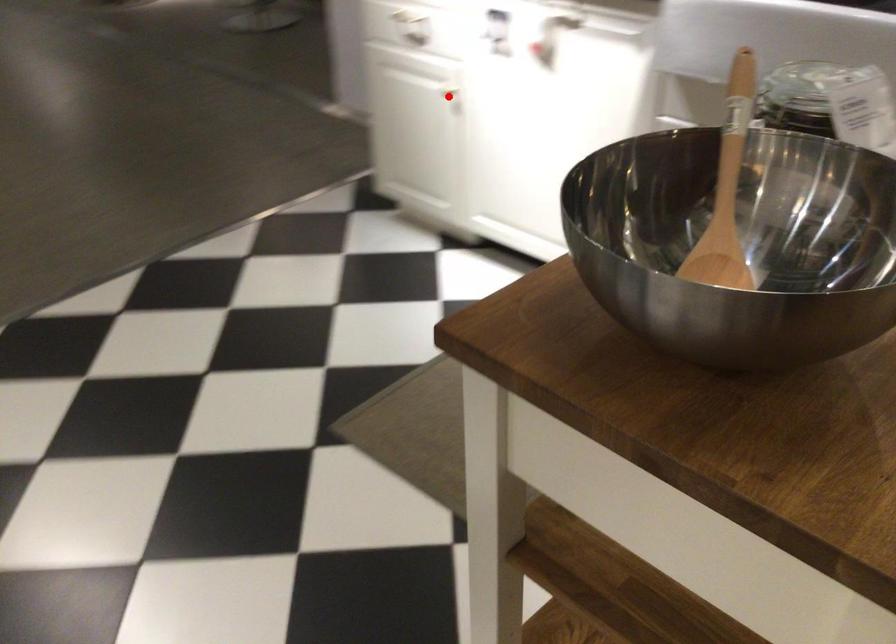
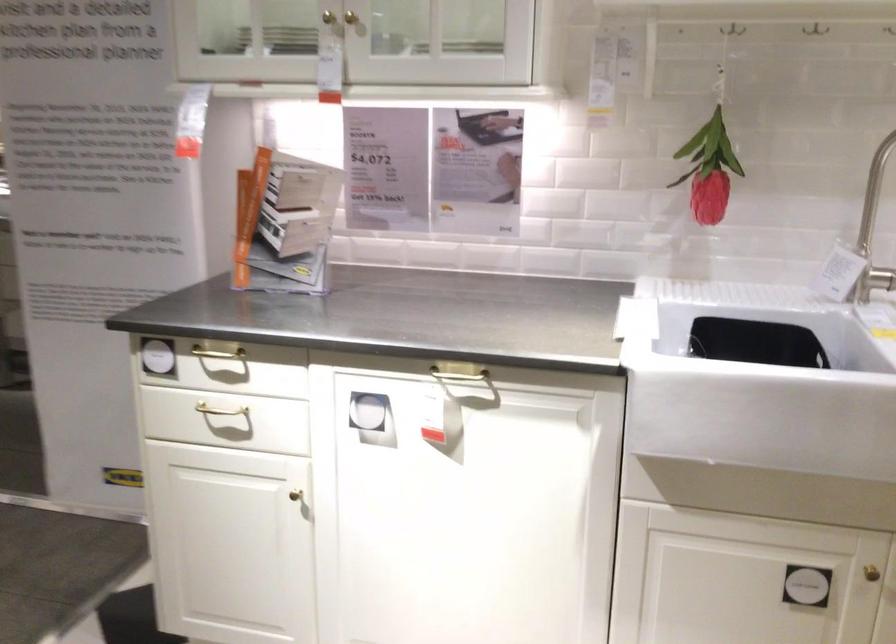
Question: I am providing you with two images of the same scene from different viewpoints. Given a red point in image1, look at the same physical point in image2. Is it:

Choices:
 (A) Closer to the viewpoint
 (B) Farther from the viewpoint

Answer: (A)